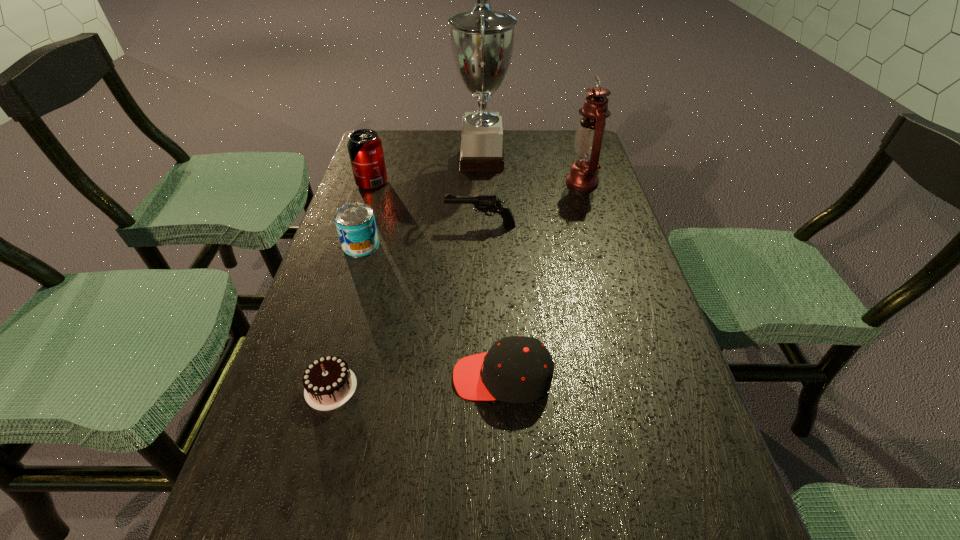
The width and height of the screenshot is (960, 540). In order to click on vacant space located at the front view of the tallest object in this screenshot , I will do `click(375, 160)`.

Where is `free region located on the front of the second tallest object`? free region located on the front of the second tallest object is located at coordinates (604, 252).

Where is `free region located 0.100m on the back of the soda can`? The height and width of the screenshot is (540, 960). free region located 0.100m on the back of the soda can is located at coordinates [x=380, y=158].

This screenshot has width=960, height=540. What are the coordinates of `blank space located 0.080m at the end of the barrel of the gun` in the screenshot? It's located at (416, 225).

Find the location of a particular element. free space located 0.090m at the end of the barrel of the gun is located at coordinates (412, 225).

Find the location of a particular element. This screenshot has height=540, width=960. blank space located 0.110m at the end of the barrel of the gun is located at coordinates 404,225.

I want to click on vacant space situated on the front of the can, so (352, 274).

Identify the location of free location located 0.320m on the front-facing side of the cap. The height and width of the screenshot is (540, 960). (283, 377).

Locate an element on the screen. This screenshot has width=960, height=540. blank space located on the front-facing side of the cap is located at coordinates (309, 377).

You are a GUI agent. You are given a task and a screenshot of the screen. Output one action in this format:
    pyautogui.click(x=<x>, y=<y>)
    Task: Click on the free region located 0.050m on the front-facing side of the cap
    
    Given the screenshot: What is the action you would take?
    pyautogui.click(x=426, y=377)